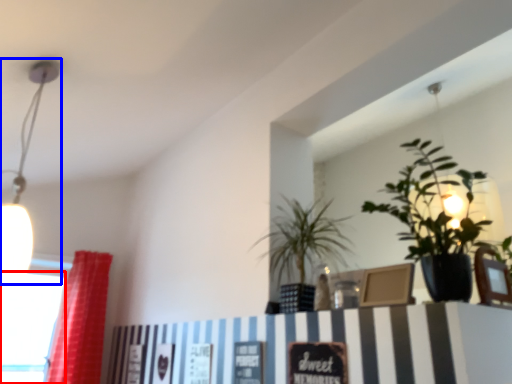
Question: Which object is closer to the camera taking this photo, window (highlighted by a red box) or lamp (highlighted by a blue box)?

Choices:
 (A) window
 (B) lamp

Answer: (B)